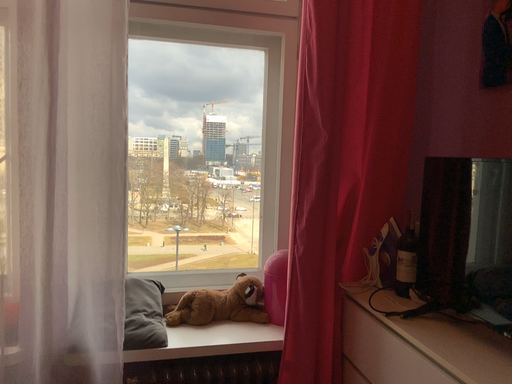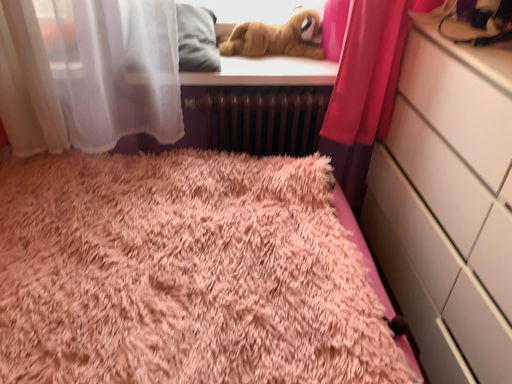
Question: Which way did the camera rotate in the video?

Choices:
 (A) rotated downward
 (B) rotated upward

Answer: (A)